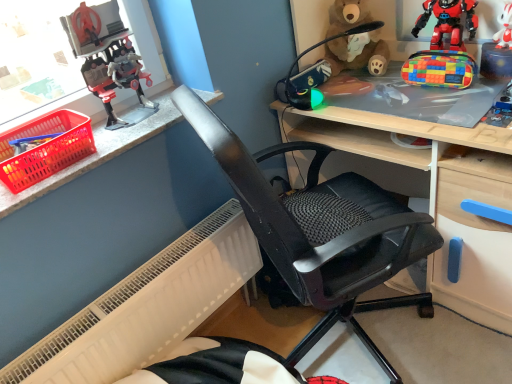
Locate an element on the screen. The image size is (512, 384). free spot above smooth stone counter top at upper left (from a real-world perspective) is located at coordinates (128, 129).